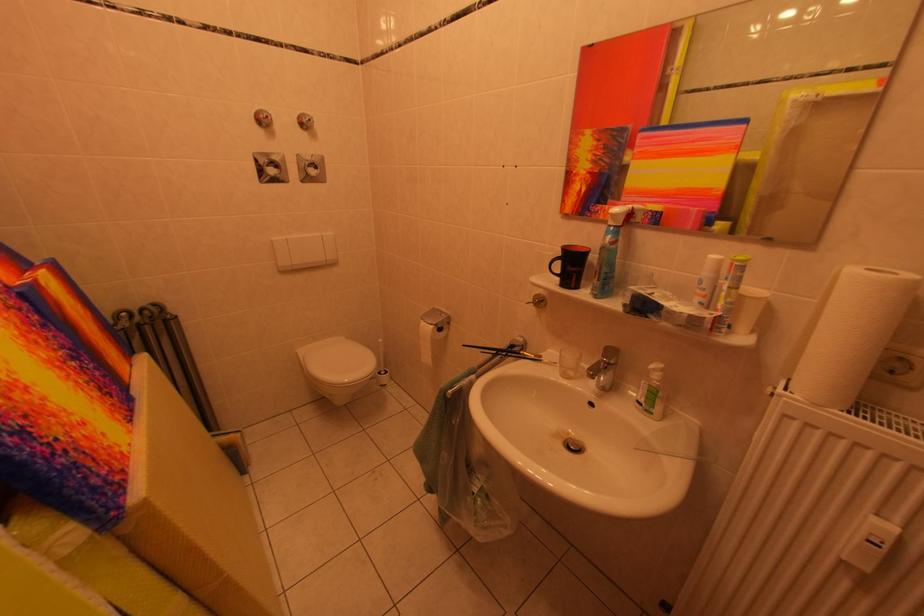
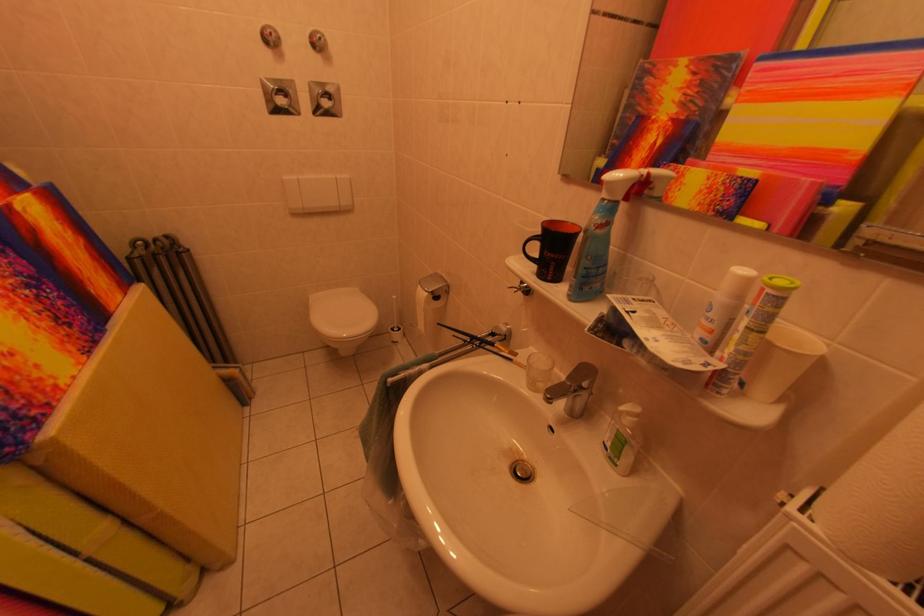
Find the pixel in the second image that matches point 388,378 in the first image.

(402, 333)